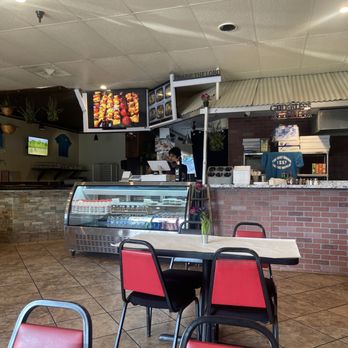
You are a GUI agent. You are given a task and a screenshot of the screen. Output one action in this format:
    pyautogui.click(x=<x>, y=<y>)
    Task: Click on the tiled floor
    Image resolution: width=348 pixels, height=348 pixels.
    Given the screenshot: What is the action you would take?
    pyautogui.click(x=66, y=280)